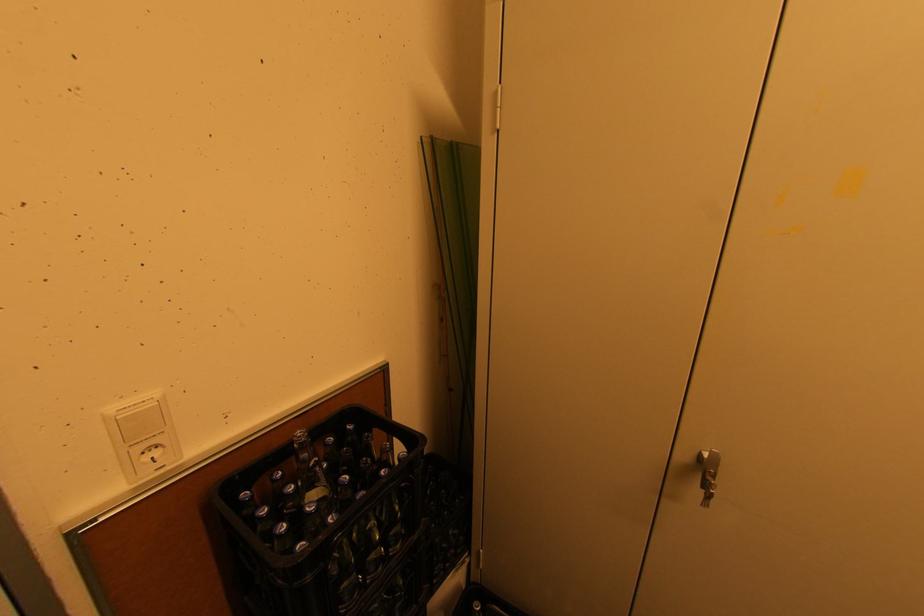
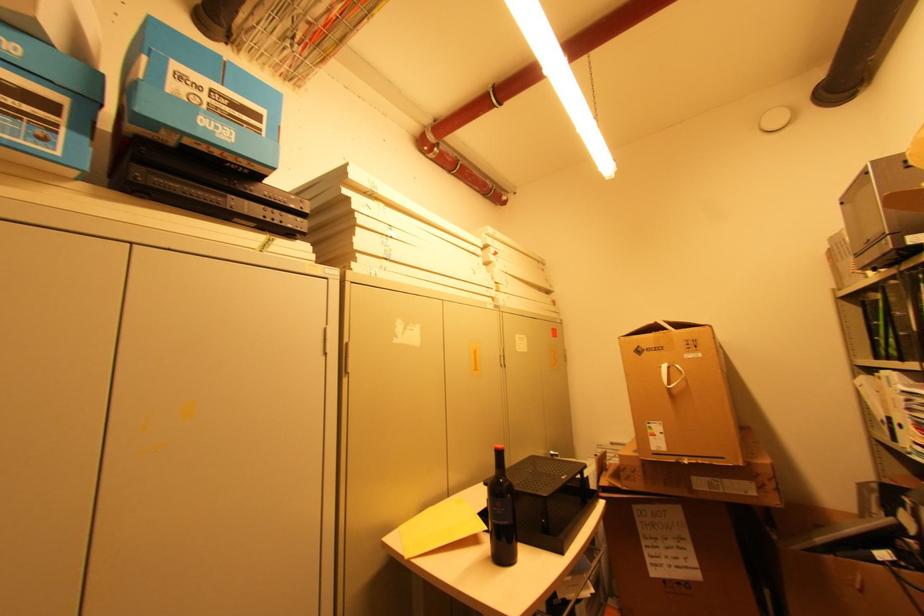
Question: Based on the continuous images, in which direction is the camera rotating? Reply with the corresponding letter.

Choices:
 (A) Left
 (B) Right
 (C) Up
 (D) Down

Answer: (B)